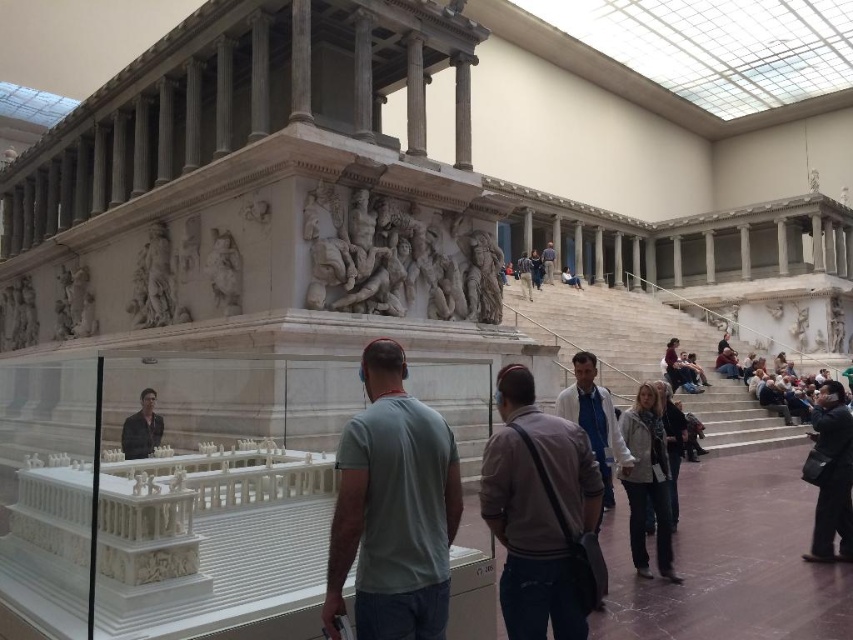
Which is below, black leather jacket at lower right or matte gray stone crowd at lower right?

Positioned lower is black leather jacket at lower right.

Can you confirm if black leather jacket at lower right is smaller than matte gray stone crowd at lower right?

Yes, black leather jacket at lower right is smaller than matte gray stone crowd at lower right.

Which is in front, point (842, 502) or point (787, 416)?

Point (842, 502) is in front.

I want to click on black leather jacket at lower right, so click(x=833, y=476).

Can you confirm if brown leather jacket at center is taller than dark brown leather jacket at lower left?

Yes.

Can you confirm if brown leather jacket at center is shorter than dark brown leather jacket at lower left?

No, brown leather jacket at center is not shorter than dark brown leather jacket at lower left.

Does point (550, 580) come behind point (141, 454)?

No, (550, 580) is closer to viewer.

Identify the location of brown leather jacket at center. (537, 509).

Measure the distance from matte gray stone crowd at lower right to denim jacket at lower right.

A distance of 15.41 meters exists between matte gray stone crowd at lower right and denim jacket at lower right.

Between point (764, 403) and point (659, 388), which one is positioned in front?

Point (659, 388) is in front.

Who is more distant from viewer, (779, 368) or (669, 449)?

Positioned behind is point (779, 368).

Identify the location of matte gray stone crowd at lower right. (788, 388).